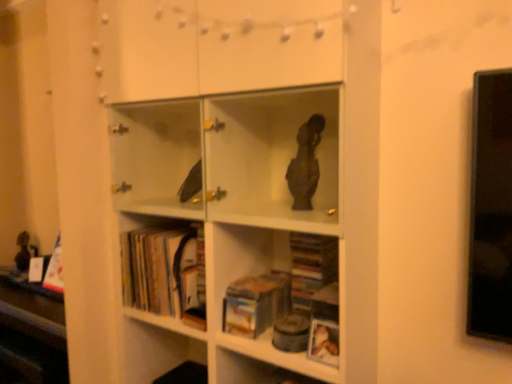
What are the coordinates of `vacant space situated above hardcover books at lower left, which is the 1th book in left-to-right order (from a real-world perspective)` in the screenshot? It's located at (163, 225).